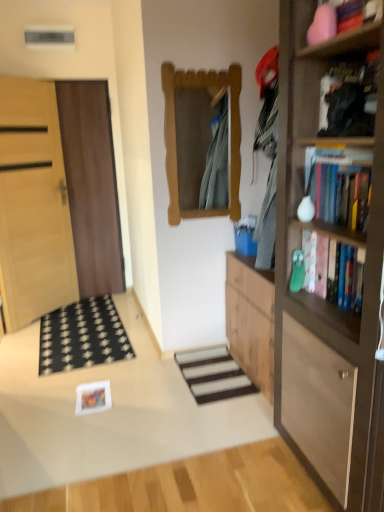
Question: Is light wood door at left, the first door viewed from the left, positioned before wooden bookshelf at right?

Choices:
 (A) yes
 (B) no

Answer: (B)

Question: From a real-world perspective, is light wood door at left, the first door viewed from the left, on wooden bookshelf at right?

Choices:
 (A) no
 (B) yes

Answer: (A)

Question: Can we say light wood door at left, which is the second door in right-to-left order, lies outside wooden bookshelf at right?

Choices:
 (A) yes
 (B) no

Answer: (A)

Question: Could you tell me if light wood door at left, the first door viewed from the left, is turned towards wooden bookshelf at right?

Choices:
 (A) yes
 (B) no

Answer: (A)

Question: Is light wood door at left, the first door viewed from the left, next to wooden bookshelf at right and touching it?

Choices:
 (A) yes
 (B) no

Answer: (B)

Question: Is light wood door at left, which is the second door in right-to-left order, looking in the opposite direction of wooden bookshelf at right?

Choices:
 (A) yes
 (B) no

Answer: (B)

Question: Is wooden mirror at center closer to camera compared to white striped carpet at center?

Choices:
 (A) yes
 (B) no

Answer: (A)

Question: Considering the relative sizes of wooden mirror at center and white striped carpet at center in the image provided, is wooden mirror at center bigger than white striped carpet at center?

Choices:
 (A) yes
 (B) no

Answer: (A)

Question: Considering the relative positions of wooden mirror at center and white striped carpet at center in the image provided, is wooden mirror at center behind white striped carpet at center?

Choices:
 (A) yes
 (B) no

Answer: (B)

Question: From a real-world perspective, is wooden mirror at center physically above white striped carpet at center?

Choices:
 (A) yes
 (B) no

Answer: (A)

Question: Would you say wooden mirror at center is a long distance from white striped carpet at center?

Choices:
 (A) yes
 (B) no

Answer: (A)

Question: Can you confirm if wooden mirror at center is shorter than white striped carpet at center?

Choices:
 (A) yes
 (B) no

Answer: (B)

Question: Does light wood door at left, which is the second door in right-to-left order, have a larger size compared to black fabric doormat at lower left?

Choices:
 (A) no
 (B) yes

Answer: (B)